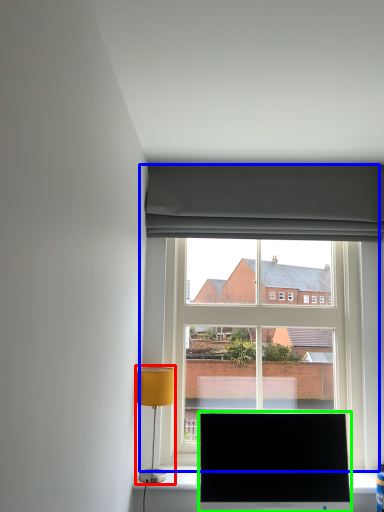
Question: Estimate the real-world distances between objects in this image. Which object is farther from table lamp (highlighted by a red box), window (highlighted by a blue box) or television (highlighted by a green box)?

Choices:
 (A) window
 (B) television

Answer: (A)